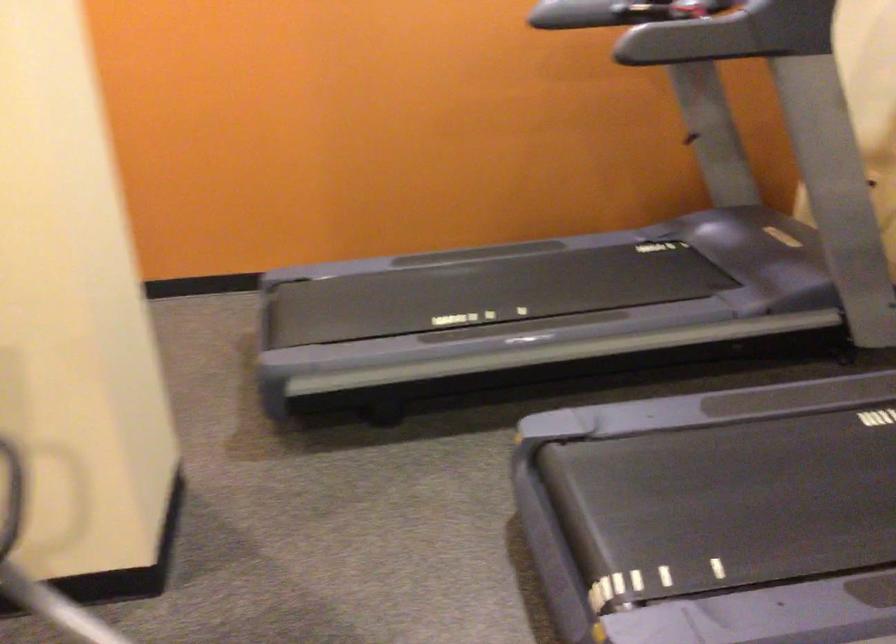
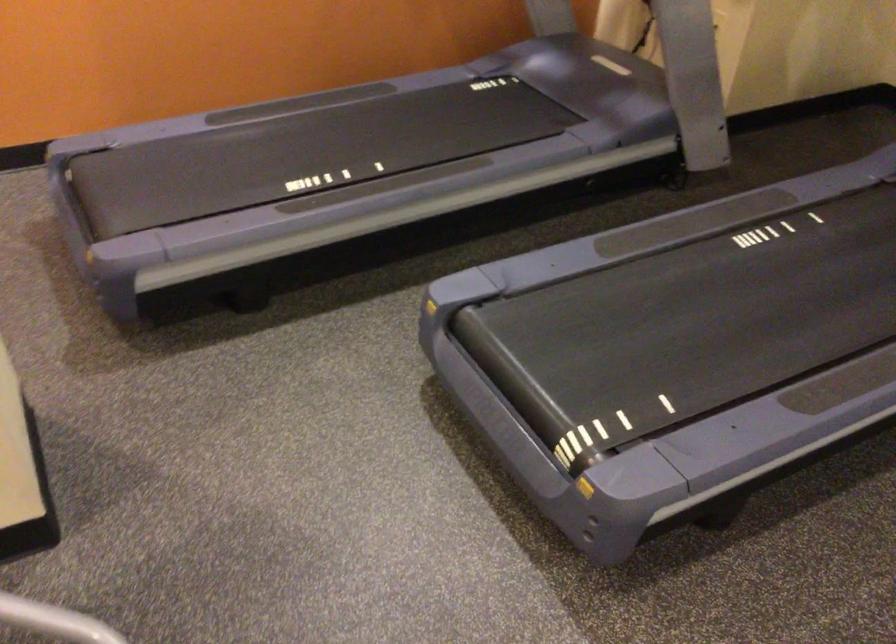
In the second image, find the point that corresponds to (412,353) in the first image.

(276, 225)